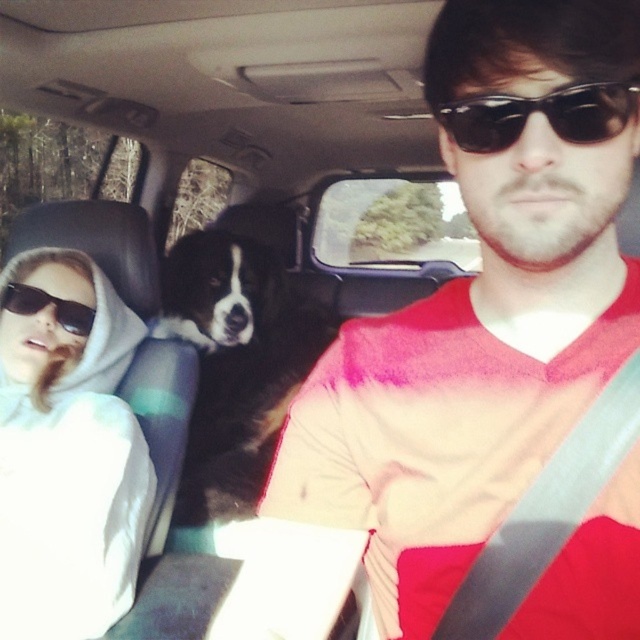
Between black fur dog at center and black plastic sunglasses at upper left, which one appears on the left side from the viewer's perspective?

black plastic sunglasses at upper left

Where is `black fur dog at center`? black fur dog at center is located at coordinates (236, 362).

Find the location of a particular element. The image size is (640, 640). black fur dog at center is located at coordinates (236, 362).

Can you confirm if white hoodie at left is positioned to the right of black plastic sunglasses at upper center?

Incorrect, white hoodie at left is not on the right side of black plastic sunglasses at upper center.

Does white hoodie at left lie in front of black plastic sunglasses at upper center?

No, it is not.

This screenshot has width=640, height=640. In order to click on white hoodie at left in this screenshot , I will do `click(67, 451)`.

At what (x,y) coordinates should I click in order to perform the action: click on white hoodie at left. Please return your answer as a coordinate pair (x, y). This screenshot has width=640, height=640. Looking at the image, I should click on (67, 451).

Which of these two, white hoodie at left or black fur dog at center, stands taller?

With more height is black fur dog at center.

Does white hoodie at left appear over black fur dog at center?

Incorrect, white hoodie at left is not positioned above black fur dog at center.

Identify the location of white hoodie at left. The width and height of the screenshot is (640, 640). (67, 451).